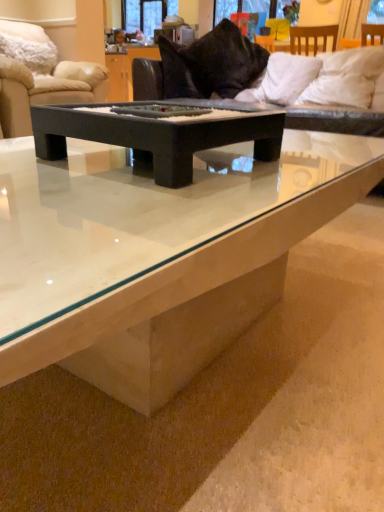
I want to click on spots to the right of black matte tray at center, the 2th coffee table in the bottom-to-top sequence, so click(299, 162).